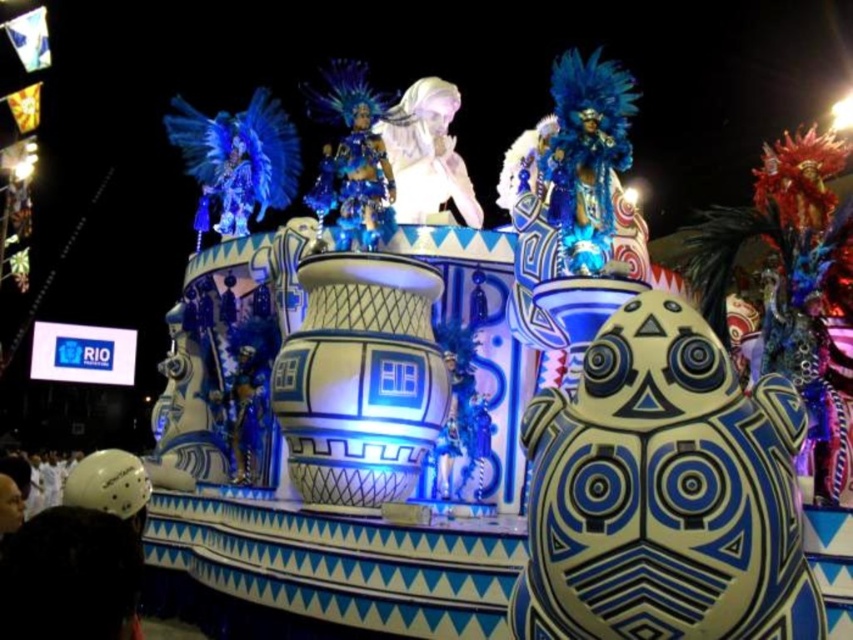
You are a photographer at the carnival parade. You want to capture a photo where both the sparkly blue costume at center and the white matte helmet at lower left are visible. Which object should you zoom in on to ensure both are in frame?

The sparkly blue costume at center is smaller than the white matte helmet at lower left. To include both in the frame, you should zoom in on the larger object, which is the white matte helmet at lower left.